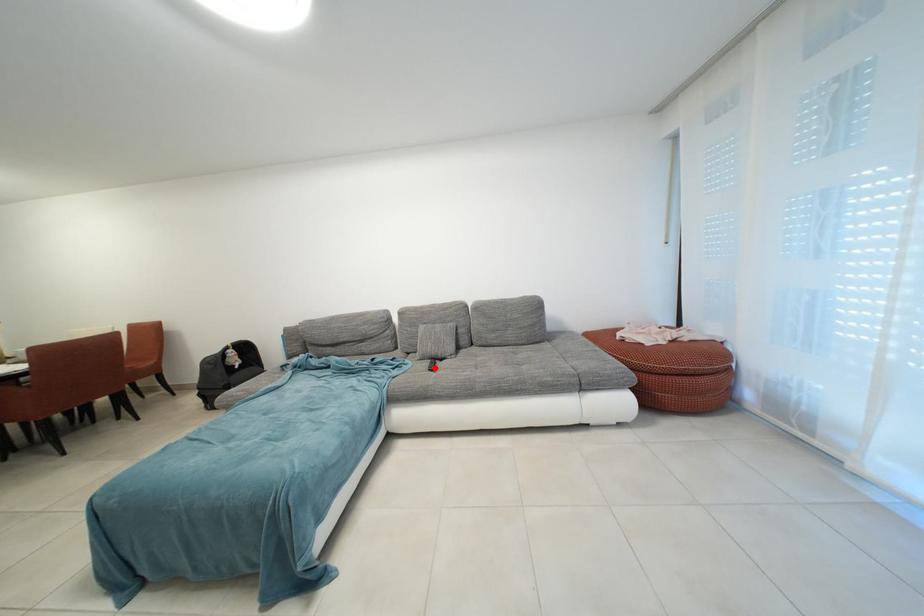
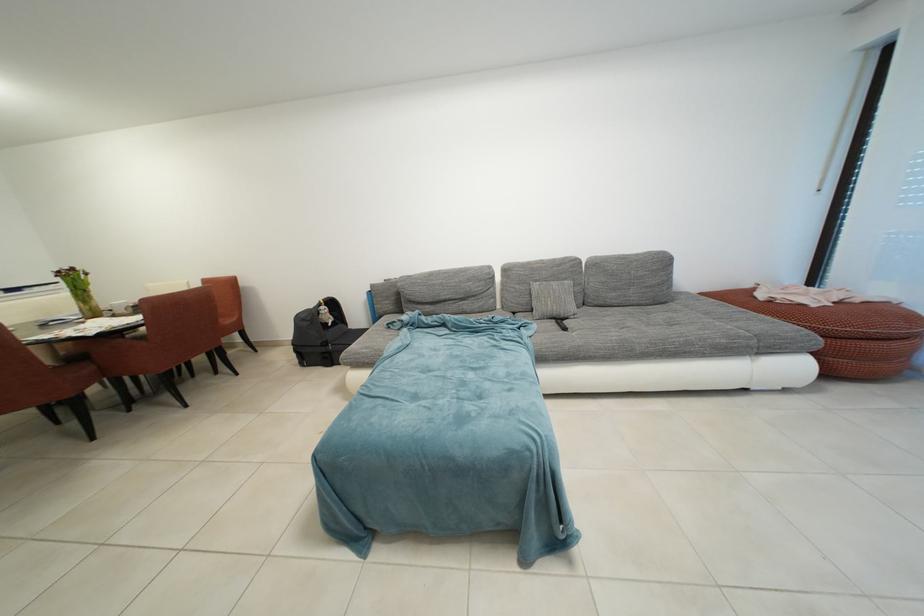
Find the pixel in the second image that matches the highlighted location in the first image.

(560, 328)